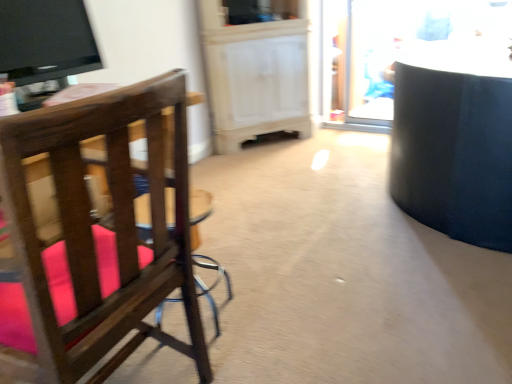
Question: Looking at their shapes, would you say transparent glass door at upper right is wider or thinner than black glossy tv at upper left?

Choices:
 (A) thin
 (B) wide

Answer: (A)

Question: From the image's perspective, is transparent glass door at upper right positioned above or below black glossy tv at upper left?

Choices:
 (A) above
 (B) below

Answer: (A)

Question: Which object is the closest to the black glossy tv at upper left?

Choices:
 (A) transparent glass door at upper right
 (B) wooden bar stool at center
 (C) wooden chair with pink cushions at left

Answer: (B)

Question: Estimate the real-world distances between objects in this image. Which object is farther from the wooden bar stool at center?

Choices:
 (A) transparent glass door at upper right
 (B) wooden chair with pink cushions at left
 (C) black glossy tv at upper left

Answer: (A)